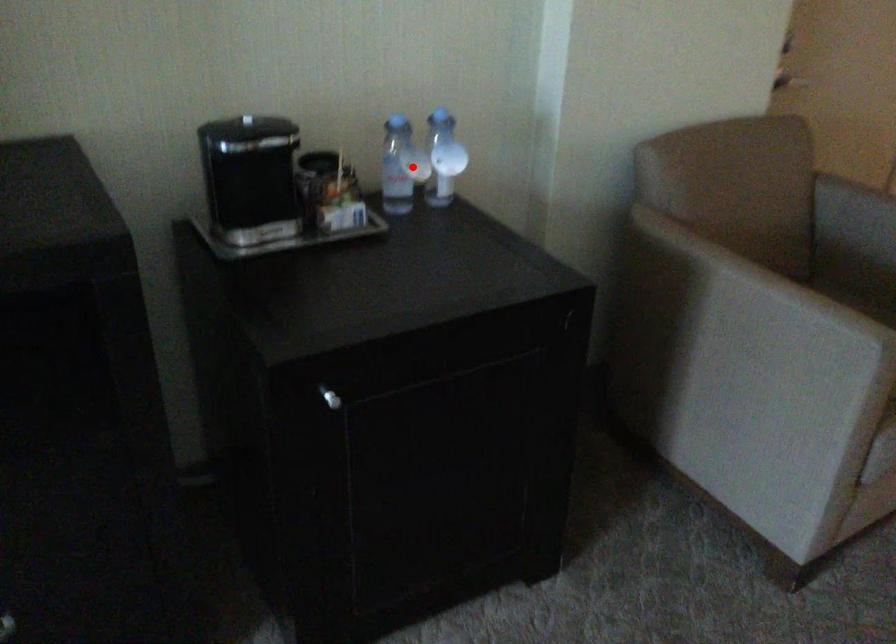
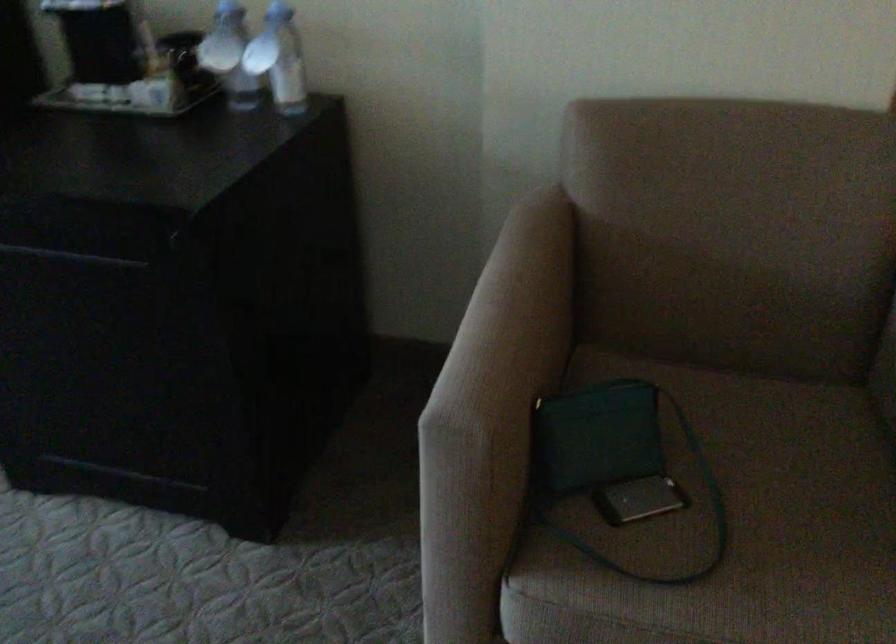
Locate, in the second image, the point that corresponds to the highlighted location in the first image.

(229, 55)